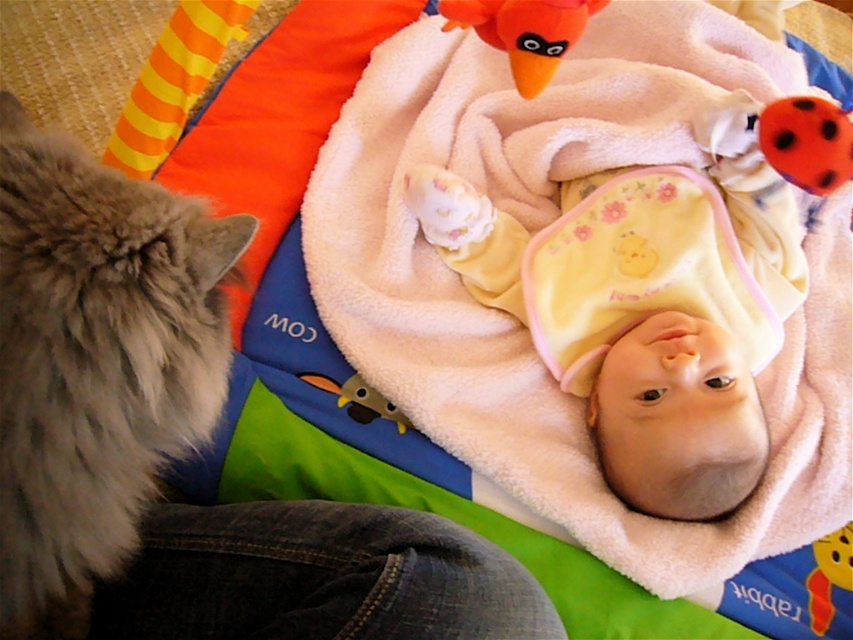
Question: Among these points, which one is nearest to the camera?

Choices:
 (A) (473, 200)
 (B) (526, 90)
 (C) (828, 109)
 (D) (815, 618)

Answer: (B)

Question: Where is white fluffy diaper at center located in relation to red plush bear at upper center in the image?

Choices:
 (A) left
 (B) right

Answer: (A)

Question: Which object appears closest to the camera in this image?

Choices:
 (A) orange matte ladybug at upper right
 (B) fuzzy gray cat at left

Answer: (B)

Question: Is yellow fleece baby at center closer to the viewer compared to fuzzy yellow duckling at center?

Choices:
 (A) yes
 (B) no

Answer: (A)

Question: Which is nearer to the yellow fleece baby at center?

Choices:
 (A) fuzzy gray cat at left
 (B) orange matte ladybug at upper right
 (C) orange plush bird at upper center
 (D) red plush bear at upper center

Answer: (B)

Question: Can you confirm if fuzzy gray cat at left is positioned to the left of orange matte ladybug at upper right?

Choices:
 (A) no
 (B) yes

Answer: (B)